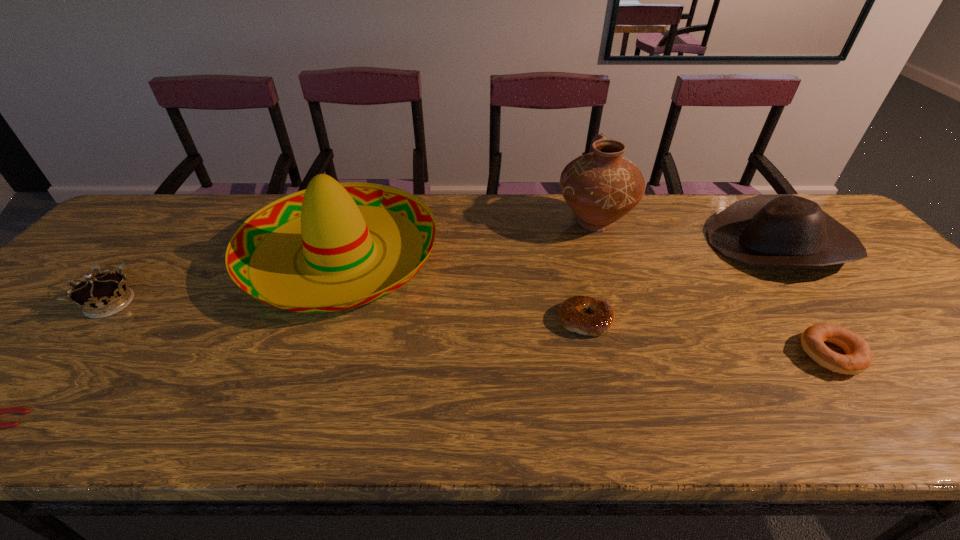
Identify the location of free space located on the left of the right bagel. (773, 355).

Locate an element on the screen. This screenshot has height=540, width=960. vacant space located 0.310m on the left of the shorter bagel is located at coordinates (426, 320).

The width and height of the screenshot is (960, 540). What are the coordinates of `pottery that is positioned at the far edge` in the screenshot? It's located at (600, 187).

The width and height of the screenshot is (960, 540). What are the coordinates of `sombrero at the far edge` in the screenshot? It's located at (335, 222).

Where is `cowboy hat that is at the far edge`? The image size is (960, 540). cowboy hat that is at the far edge is located at coordinates (766, 230).

Where is `object present at the left edge`? object present at the left edge is located at coordinates (101, 295).

Locate an element on the screen. The height and width of the screenshot is (540, 960). object present at the right edge is located at coordinates (766, 230).

Where is `object at the far right corner`? The image size is (960, 540). object at the far right corner is located at coordinates (766, 230).

Locate an element on the screen. vacant space at the far edge of the desktop is located at coordinates (550, 222).

In the image, there is a desktop. At what (x,y) coordinates should I click in order to perform the action: click on free space at the near edge. Please return your answer as a coordinate pair (x, y). The image size is (960, 540). Looking at the image, I should click on (108, 426).